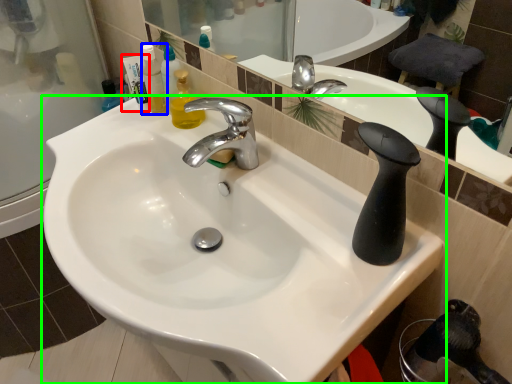
Question: Which object is the closest to the toiletry (highlighted by a red box)? Choose among these: mouthwash (highlighted by a blue box) or sink (highlighted by a green box).

Choices:
 (A) mouthwash
 (B) sink

Answer: (A)